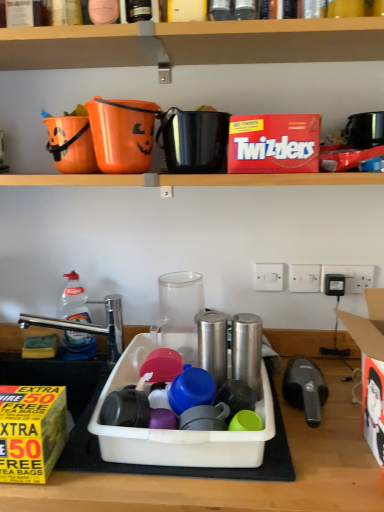
Question: Is wooden shelf at upper center situated inside yellow paper box at lower left, which ranks as the first box in left-to-right order, or outside?

Choices:
 (A) outside
 (B) inside

Answer: (A)

Question: Visually, is wooden shelf at upper center positioned to the left or to the right of yellow paper box at lower left, which appears as the 2th box when viewed from the back?

Choices:
 (A) left
 (B) right

Answer: (B)

Question: Based on their relative distances, which object is nearer to the black plastic kettle at upper right, which ranks as the 5th appliance in left-to-right order?

Choices:
 (A) plastic container at center
 (B) white plastic electric outlet at center, the second electric outlet positioned from the right
 (C) yellow paper box at lower left, the 2th box when ordered from top to bottom
 (D) wooden shelf at upper center
 (E) white cardboard lunch box at right

Answer: (B)

Question: Based on their relative distances, which object is farther from the red cardboard box at upper center, the second box from the left?

Choices:
 (A) wooden shelf at upper center
 (B) white plastic container at center
 (C) white plastic switch at upper center, placed as the 1th electric outlet when sorted from left to right
 (D) white plastic electric outlet at upper right, placed as the first electric outlet when sorted from right to left
 (E) plastic container at center

Answer: (E)